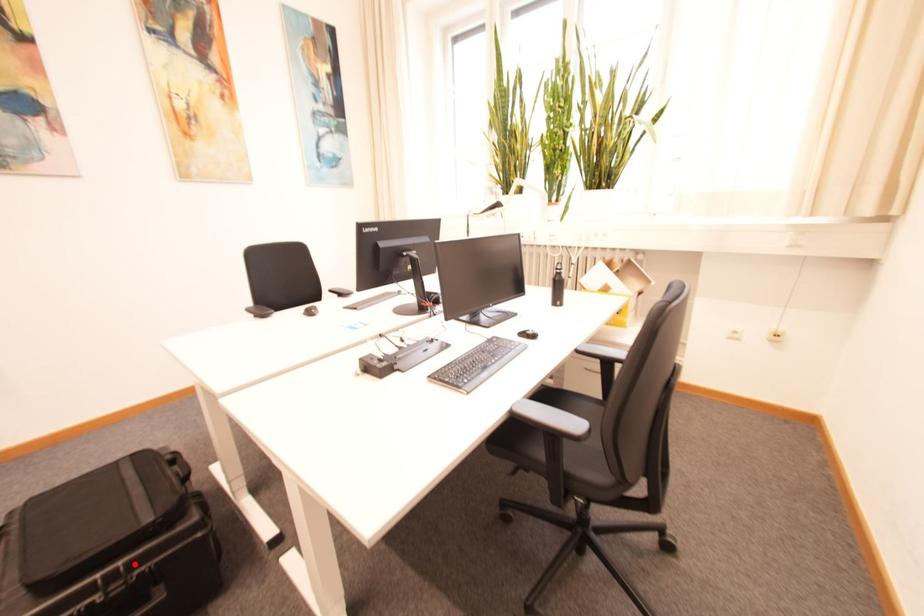
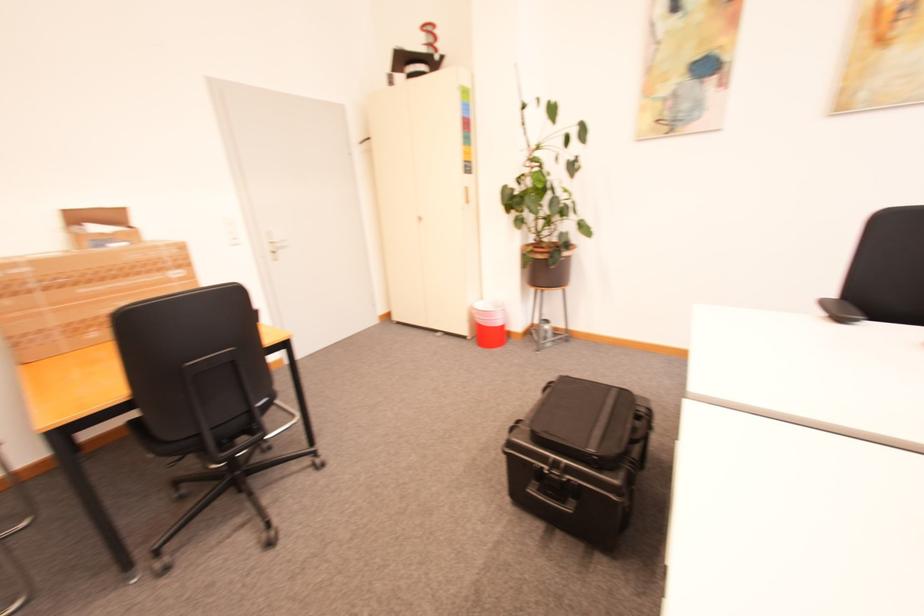
Question: I am providing you with two images of the same scene from different viewpoints. Image1 has a red point marked. In image2, the corresponding 3D location appears at what relative position? Reply with the corresponding letter.

Choices:
 (A) Closer
 (B) Farther

Answer: (B)